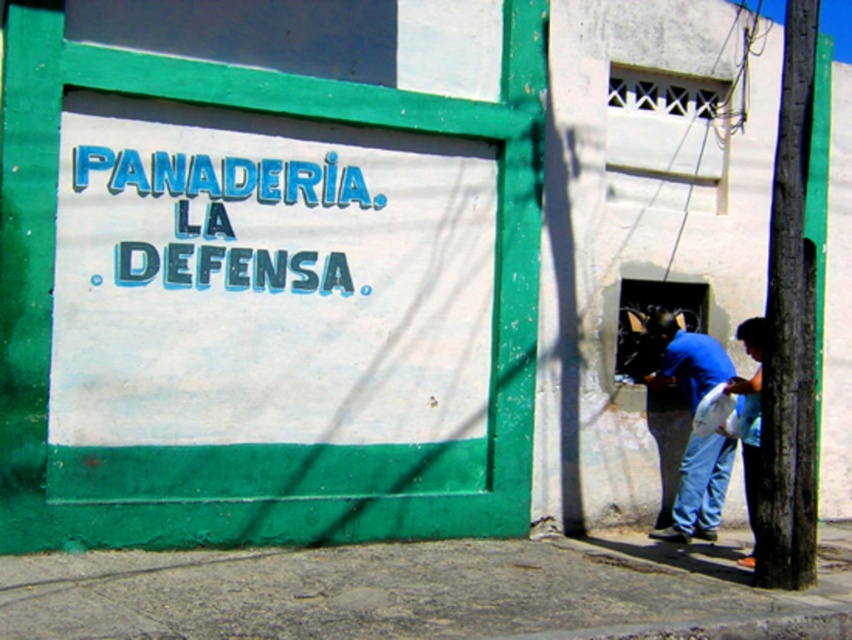
Which is below, dark brown wood pole at right or blue cotton shirt at lower right?

blue cotton shirt at lower right is lower down.

Is dark brown wood pole at right to the right of blue cotton shirt at lower right from the viewer's perspective?

Indeed, dark brown wood pole at right is positioned on the right side of blue cotton shirt at lower right.

Is point (799, 193) behind point (663, 312)?

No, (799, 193) is closer to viewer.

This screenshot has height=640, width=852. I want to click on dark brown wood pole at right, so click(790, 330).

Does dark brown wood pole at right appear under blue denim jeans at lower right?

Incorrect, dark brown wood pole at right is not positioned below blue denim jeans at lower right.

Find the location of `dark brown wood pole at right`. dark brown wood pole at right is located at coordinates (790, 330).

Locate an element on the screen. The height and width of the screenshot is (640, 852). dark brown wood pole at right is located at coordinates (790, 330).

Between blue cotton shirt at lower right and blue denim jeans at lower right, which one appears on the left side from the viewer's perspective?

Positioned to the left is blue cotton shirt at lower right.

Can you confirm if blue cotton shirt at lower right is bigger than blue denim jeans at lower right?

No, blue cotton shirt at lower right is not bigger than blue denim jeans at lower right.

Where is `blue cotton shirt at lower right`? The image size is (852, 640). blue cotton shirt at lower right is located at coordinates (699, 488).

This screenshot has height=640, width=852. I want to click on blue cotton shirt at lower right, so (x=699, y=488).